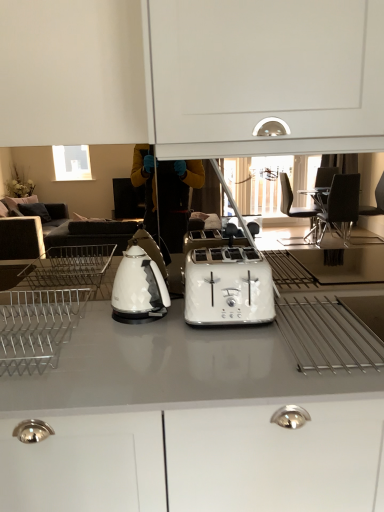
The width and height of the screenshot is (384, 512). What do you see at coordinates (228, 287) in the screenshot?
I see `white glossy toaster at center` at bounding box center [228, 287].

The image size is (384, 512). Identify the location of white glossy electric kettle at left. (139, 288).

The width and height of the screenshot is (384, 512). I want to click on metallic silver dish rack at left, so click(x=37, y=327).

Does metallic silver dish rack at left come in front of white glossy countertop at center?

No, the depth of metallic silver dish rack at left is greater than that of white glossy countertop at center.

Is there a large distance between metallic silver dish rack at left and white glossy countertop at center?

No, metallic silver dish rack at left is not far from white glossy countertop at center.

Is point (75, 312) positioned after point (54, 389)?

Yes, point (75, 312) is behind point (54, 389).

Which object is further away from the camera, white glossy electric kettle at left or white glossy countertop at center?

Positioned behind is white glossy electric kettle at left.

From a real-world perspective, between white glossy electric kettle at left and white glossy countertop at center, who is vertically lower?

From a 3D spatial view, white glossy countertop at center is below.

From the image's perspective, which object appears higher, white glossy electric kettle at left or white glossy countertop at center?

white glossy electric kettle at left.

In the scene shown: Could you tell me if white glossy toaster at center is facing metallic silver dish rack at left?

No.

Would you say white glossy toaster at center is a long distance from metallic silver dish rack at left?

white glossy toaster at center is actually quite close to metallic silver dish rack at left.

In the scene shown: Would you say white glossy countertop at center is to the left or to the right of white glossy toaster at center in the picture?

From the image, it's evident that white glossy countertop at center is to the left of white glossy toaster at center.

Considering the relative sizes of white glossy countertop at center and white glossy toaster at center in the image provided, is white glossy countertop at center bigger than white glossy toaster at center?

Result: Yes.

Do you think white glossy countertop at center is within white glossy toaster at center, or outside of it?

white glossy countertop at center lies outside white glossy toaster at center.

From the image's perspective, which object appears higher, white glossy countertop at center or white glossy toaster at center?

white glossy toaster at center, from the image's perspective.

Which of these two, white glossy toaster at center or white glossy electric kettle at left, is smaller?

With smaller size is white glossy electric kettle at left.

Is the position of white glossy toaster at center more distant than that of white glossy electric kettle at left?

No, it is not.

Is white glossy toaster at center not inside white glossy electric kettle at left?

Yes, white glossy toaster at center is outside of white glossy electric kettle at left.

Relative to metallic silver dish rack at left, is white glossy countertop at center in front or behind?

In the image, white glossy countertop at center appears in front of metallic silver dish rack at left.

How much distance is there between white glossy countertop at center and metallic silver dish rack at left?

white glossy countertop at center and metallic silver dish rack at left are 13.54 inches apart.

Is white glossy countertop at center far away from metallic silver dish rack at left?

white glossy countertop at center is actually quite close to metallic silver dish rack at left.

From a real-world perspective, between white glossy countertop at center and metallic silver dish rack at left, who is vertically lower?

In real-world perspective, white glossy countertop at center is lower.

Based on the photo, which object is positioned more to the right, white glossy electric kettle at left or white glossy toaster at center?

white glossy toaster at center is more to the right.

From the image's perspective, between white glossy electric kettle at left and white glossy toaster at center, who is located below?

From the image's view, white glossy toaster at center is below.

Considering the positions of points (131, 248) and (264, 288), is point (131, 248) farther from camera compared to point (264, 288)?

Yes, it is behind point (264, 288).

The width and height of the screenshot is (384, 512). I want to click on cabinetry in front of the metallic silver dish rack at left, so click(x=189, y=424).

I want to click on kitchen appliance behind the white glossy countertop at center, so click(x=139, y=288).

Based on their spatial positions, is white glossy toaster at center or white glossy countertop at center closer to white glossy electric kettle at left?

The object closer to white glossy electric kettle at left is white glossy toaster at center.

Which object lies nearer to the anchor point white glossy toaster at center, metallic silver dish rack at left or white glossy electric kettle at left?

white glossy electric kettle at left.

Based on their spatial positions, is white glossy countertop at center or white glossy electric kettle at left further from metallic silver dish rack at left?

Among the two, white glossy countertop at center is located further to metallic silver dish rack at left.

Based on their spatial positions, is metallic silver dish rack at left or white glossy toaster at center further from white glossy countertop at center?

Among the two, metallic silver dish rack at left is located further to white glossy countertop at center.

Based on their spatial positions, is white glossy toaster at center or white glossy electric kettle at left closer to metallic silver dish rack at left?

white glossy electric kettle at left is positioned closer to the anchor metallic silver dish rack at left.

Looking at the image, which one is located closer to white glossy electric kettle at left, white glossy countertop at center or white glossy toaster at center?

white glossy toaster at center lies closer to white glossy electric kettle at left than the other object.

From the picture: Estimate the real-world distances between objects in this image. Which object is closer to white glossy toaster at center, metallic silver dish rack at left or white glossy countertop at center?

white glossy countertop at center.

When comparing their distances from white glossy countertop at center, does white glossy toaster at center or white glossy electric kettle at left seem further?

Among the two, white glossy electric kettle at left is located further to white glossy countertop at center.

Image resolution: width=384 pixels, height=512 pixels. Find the location of `home appliance that lies between white glossy electric kettle at left and white glossy countertop at center from top to bottom`. home appliance that lies between white glossy electric kettle at left and white glossy countertop at center from top to bottom is located at coordinates (37, 327).

Identify the location of toaster between white glossy electric kettle at left and white glossy countertop at center in the vertical direction. [x=228, y=287].

The height and width of the screenshot is (512, 384). I want to click on cabinetry between metallic silver dish rack at left and white glossy toaster at center in the horizontal direction, so click(x=189, y=424).

What are the coordinates of `kitchen appliance located between metallic silver dish rack at left and white glossy toaster at center in the left-right direction` in the screenshot? It's located at (139, 288).